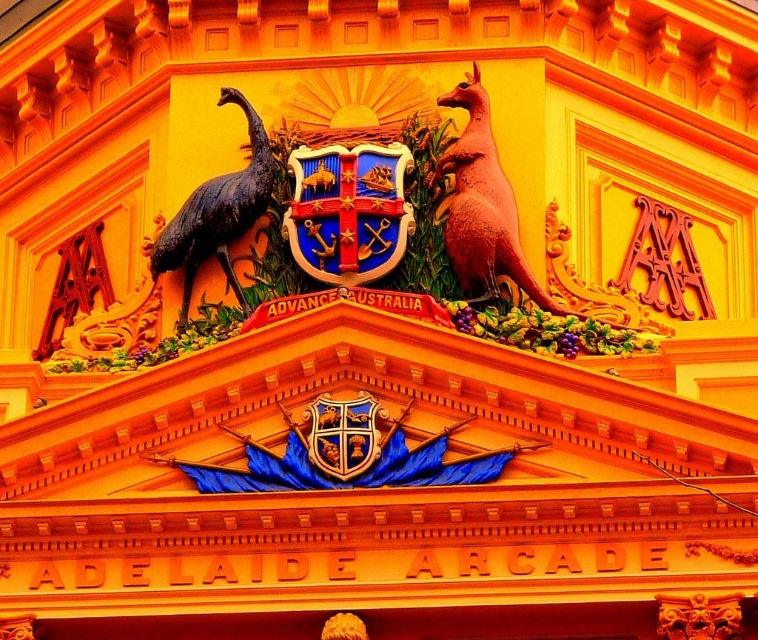
Question: Which of the following is the farthest from the observer?

Choices:
 (A) rubber-like pink kangaroo at upper right
 (B) shiny bronze emu at left

Answer: (B)

Question: Does rubber-like pink kangaroo at upper right have a lesser width compared to shiny bronze emu at left?

Choices:
 (A) no
 (B) yes

Answer: (B)

Question: In this image, where is rubber-like pink kangaroo at upper right located relative to shiny bronze emu at left?

Choices:
 (A) left
 (B) right

Answer: (B)

Question: Can you confirm if rubber-like pink kangaroo at upper right is positioned below shiny bronze emu at left?

Choices:
 (A) no
 (B) yes

Answer: (B)

Question: Which point is farther to the camera?

Choices:
 (A) shiny bronze emu at left
 (B) rubber-like pink kangaroo at upper right

Answer: (A)